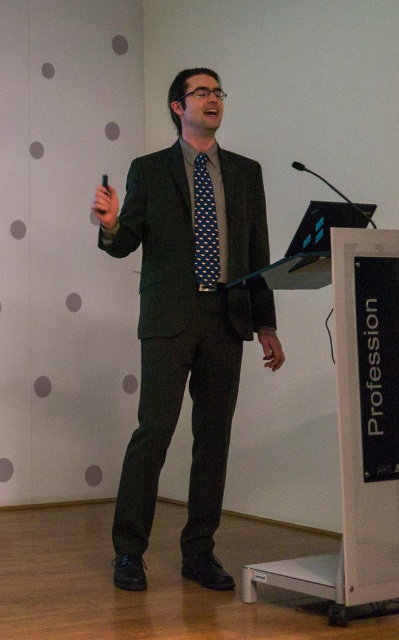
Which is above, matte black suit at center or blue dotted tie at center?

blue dotted tie at center

From the picture: Which of these two, matte black suit at center or blue dotted tie at center, stands taller?

matte black suit at center

Is point (158, 451) closer to viewer compared to point (207, 246)?

Yes, point (158, 451) is closer to viewer.

Locate an element on the screen. matte black suit at center is located at coordinates (187, 323).

Looking at this image, who is more distant from viewer, (209, 253) or (300, 164)?

Positioned behind is point (209, 253).

The height and width of the screenshot is (640, 399). Identify the location of blue dotted tie at center. (205, 227).

You are a GUI agent. You are given a task and a screenshot of the screen. Output one action in this format:
    pyautogui.click(x=<x>, y=<y>)
    Task: Click on the blue dotted tie at center
    The image size is (399, 640).
    Given the screenshot: What is the action you would take?
    pyautogui.click(x=205, y=227)

The width and height of the screenshot is (399, 640). I want to click on matte black suit at center, so click(x=187, y=323).

Is point (211, 566) closer to camera compared to point (369, 218)?

That is False.

The image size is (399, 640). Find the location of `matte black suit at center`. matte black suit at center is located at coordinates (187, 323).